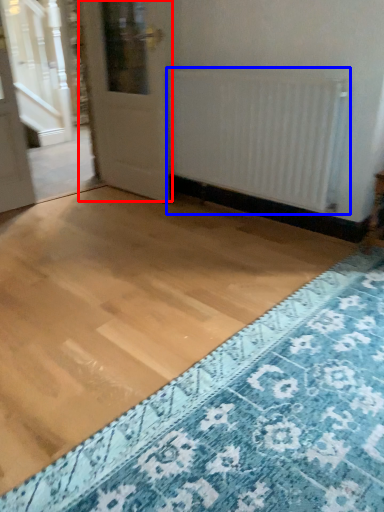
Question: Among these objects, which one is nearest to the camera, door (highlighted by a red box) or radiator (highlighted by a blue box)?

Choices:
 (A) door
 (B) radiator

Answer: (B)